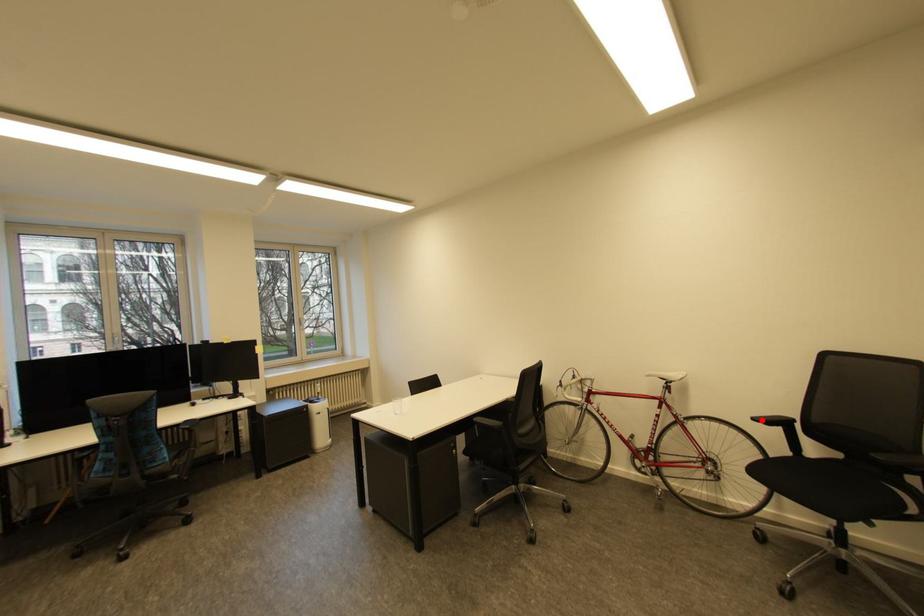
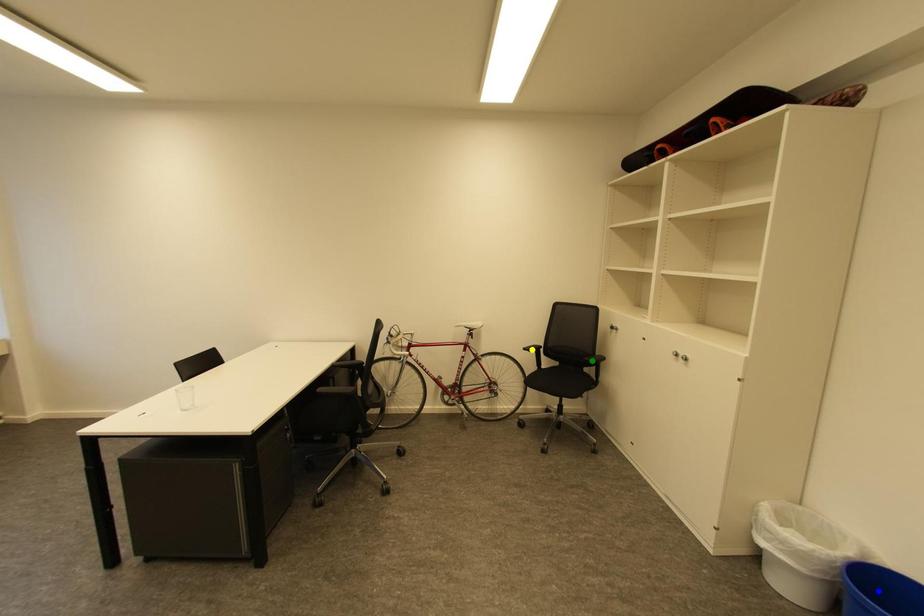
Question: I am providing you with two images of the same scene from different viewpoints. A red point is marked on the first image. You are given multiple points on the second image. Which point in image 2 represents the same 3d spot as the red point in image 1?

Choices:
 (A) blue point
 (B) yellow point
 (C) green point

Answer: (B)